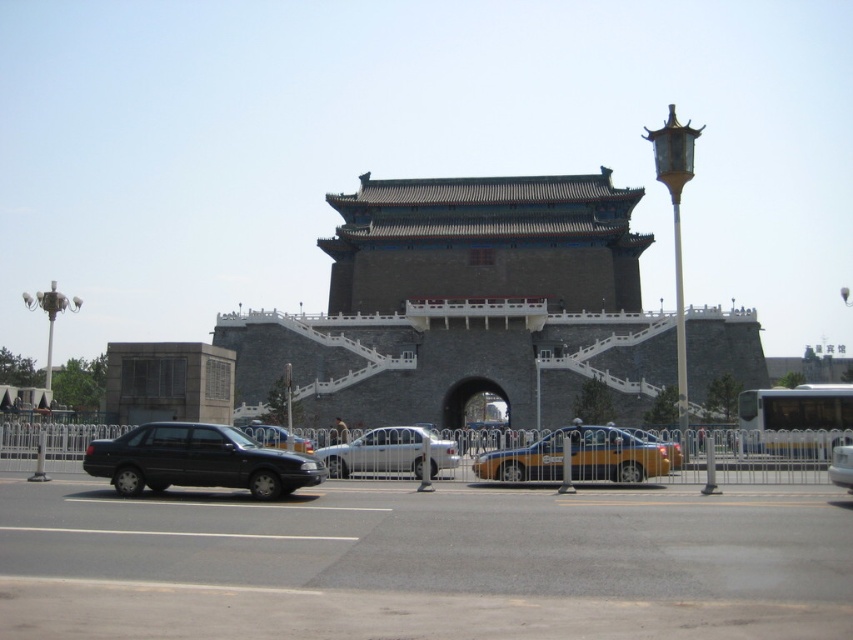
Does dark gray stone fort at center appear on the right side of yellow matte taxi at center?

No, dark gray stone fort at center is not to the right of yellow matte taxi at center.

Is point (332, 268) more distant than point (643, 467)?

Yes, point (332, 268) is farther from viewer.

Image resolution: width=853 pixels, height=640 pixels. Describe the element at coordinates (465, 305) in the screenshot. I see `dark gray stone fort at center` at that location.

Image resolution: width=853 pixels, height=640 pixels. Find the location of `dark gray stone fort at center`. dark gray stone fort at center is located at coordinates (465, 305).

Which is behind, point (659, 458) or point (263, 435)?

The point (263, 435) is behind.

Between point (583, 435) and point (271, 440), which one is positioned behind?

The point (271, 440) is more distant.

Where is `yellow matte taxi at center`? This screenshot has width=853, height=640. yellow matte taxi at center is located at coordinates (578, 458).

Between shiny black sedan at center and metallic silver car at center, which one has less height?

shiny black sedan at center is shorter.

Is shiny black sedan at center wider than metallic silver car at center?

Indeed, shiny black sedan at center has a greater width compared to metallic silver car at center.

Is point (270, 428) less distant than point (850, 468)?

No.

You are a GUI agent. You are given a task and a screenshot of the screen. Output one action in this format:
    pyautogui.click(x=<x>, y=<y>)
    Task: Click on the shiny black sedan at center
    The width and height of the screenshot is (853, 640).
    Given the screenshot: What is the action you would take?
    pyautogui.click(x=276, y=436)